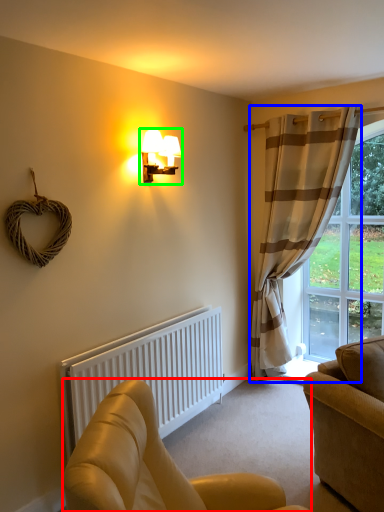
Question: Which is farther away from studio couch (highlighted by a red box)? curtain (highlighted by a blue box) or lamp (highlighted by a green box)?

Choices:
 (A) curtain
 (B) lamp

Answer: (A)